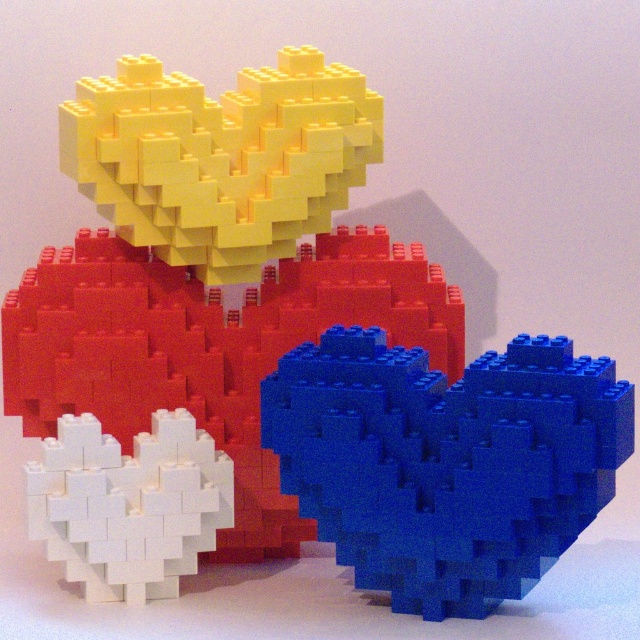
You are an artist trying to recreate the LEGO structure. You have both the blue matte heart at center and the white matte heart at lower left in front of you. Which heart should you place to the right to match the original design?

The blue matte heart at center should be placed to the right of the white matte heart at lower left to match the original design.

What is located at the point marked by coordinates (445, 461) in the LEGO structure?

The point marked by coordinates (445, 461) in the LEGO structure is where the blue matte heart at center is located.

You are observing the LEGO bird structure from the front. There are two points marked on it labeled as point (289, 483) and point (177, 433). Which of these points is closer to your viewpoint?

Point (289, 483) is closer to the camera than point (177, 433).